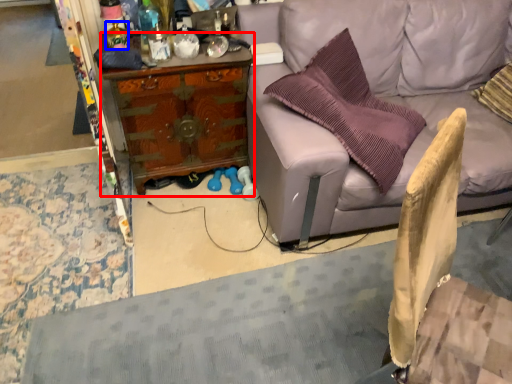
Question: Which point is further to the camera, desk (highlighted by a red box) or bottle (highlighted by a blue box)?

Choices:
 (A) desk
 (B) bottle

Answer: (A)